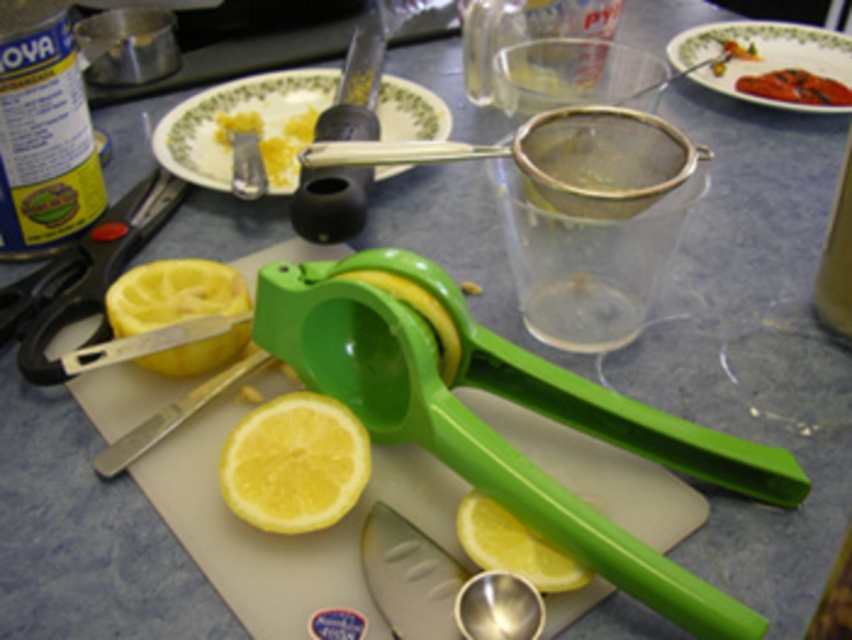
You are a chef preparing a dish and need to know which item is lower in height between the yellow matte lemon at center and the grilled meat at upper right. Can you tell me?

The yellow matte lemon at center is shorter than the grilled meat at upper right, so the yellow matte lemon at center is lower in height.

You are organizing a kitchen counter and need to move items to make space for a large bowl. The green matte juicer at center and grilled meat at upper right are in the way. Which item should you move first to free up more space?

The grilled meat at upper right occupies more space than the green matte juicer at center, so moving it first would free up more space.

You are a chef trying to locate the lemon for a recipe. The kitchen counter has a green citrus juicer on a cutting board. Where exactly is the yellow matte lemon at center located in terms of coordinates?

The yellow matte lemon at center is located at coordinates point (294, 464).